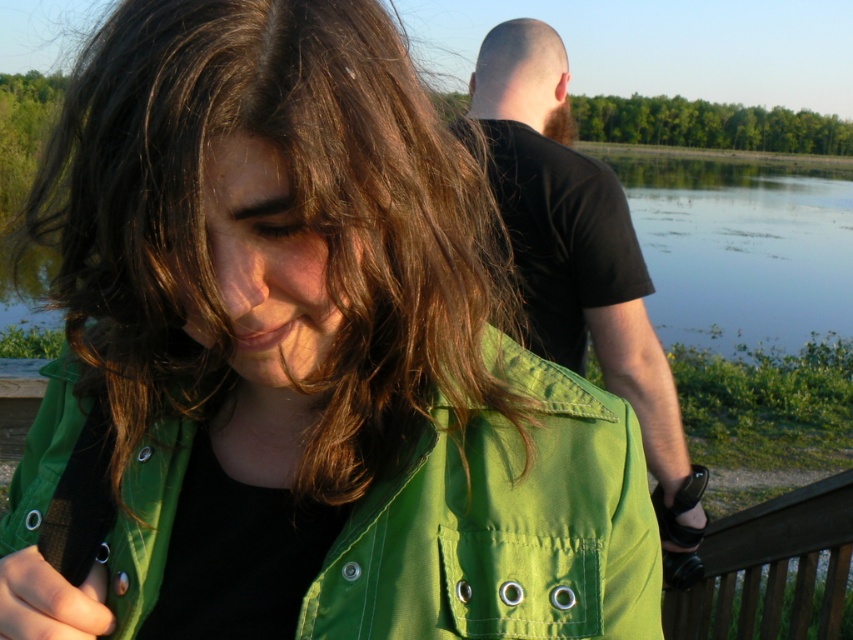
You are standing at the edge of the lake and want to place a small boat on the water. Which object, the clear water at lake right or the brown wooden rail at lower right, should you place the boat on and why?

You should place the boat on the clear water at lake right because the brown wooden rail at lower right is behind it, meaning the rail is not on the water surface where the boat can float.